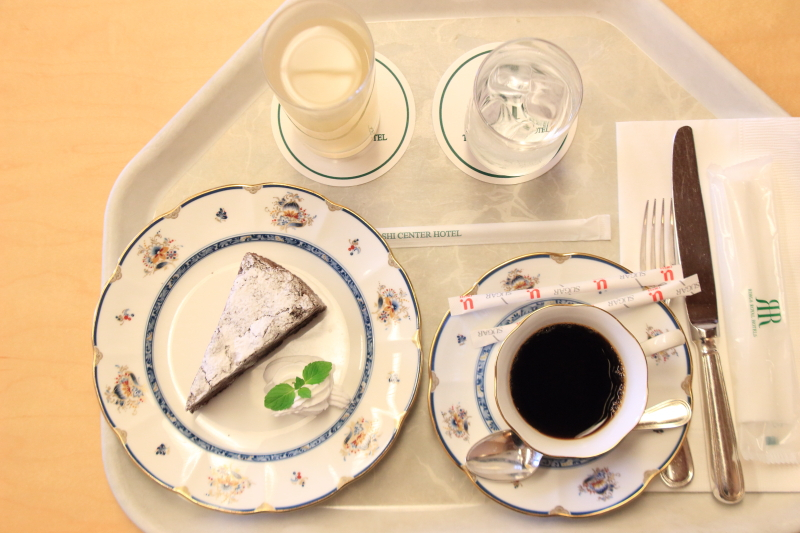
Locate an element on the screen. butter knife is located at coordinates (690, 225), (722, 431).